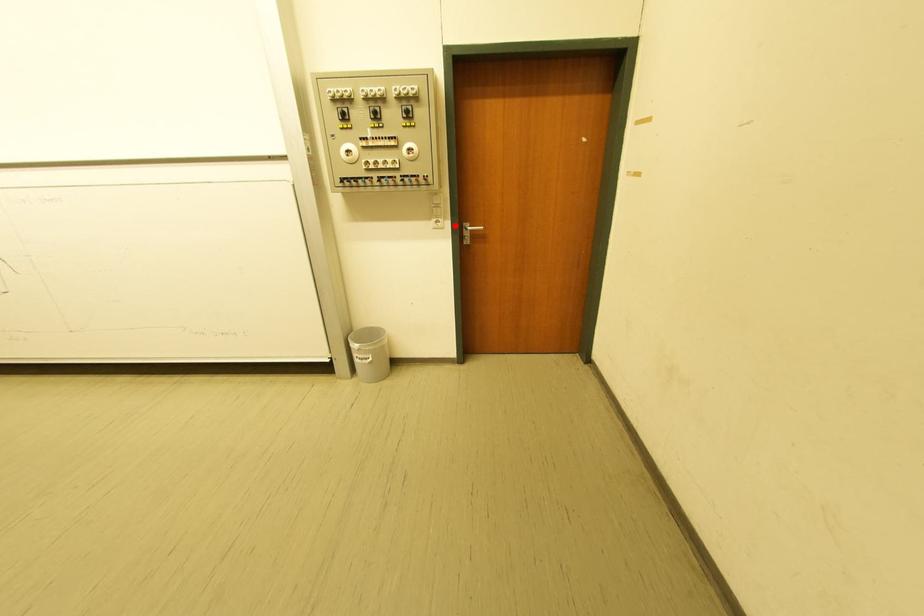
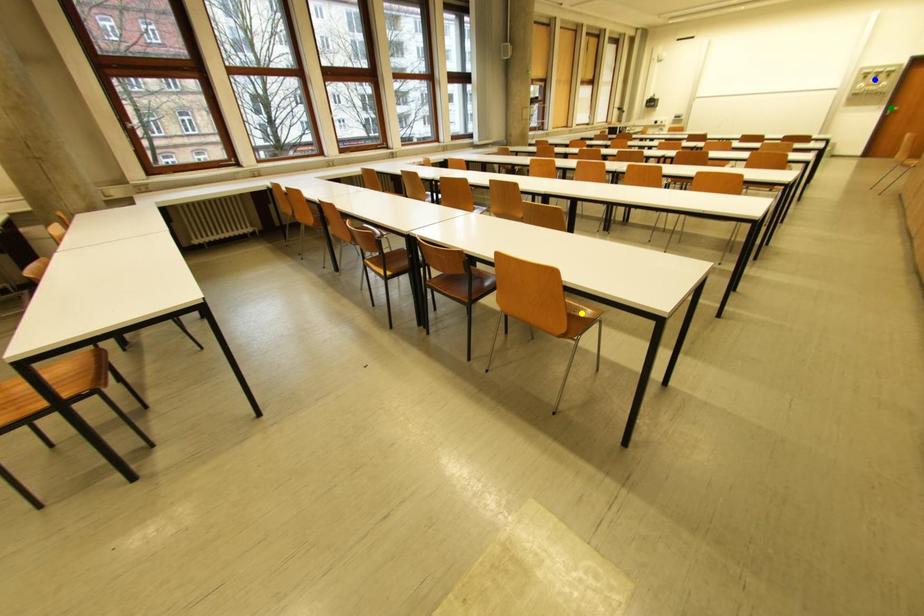
Question: I am providing you with two images of the same scene from different viewpoints. A red point is marked on the first image. You are given multiple points on the second image. Can you choose the point in image 2 that corresponds to the point in image 1?

Choices:
 (A) yellow point
 (B) blue point
 (C) green point

Answer: (C)